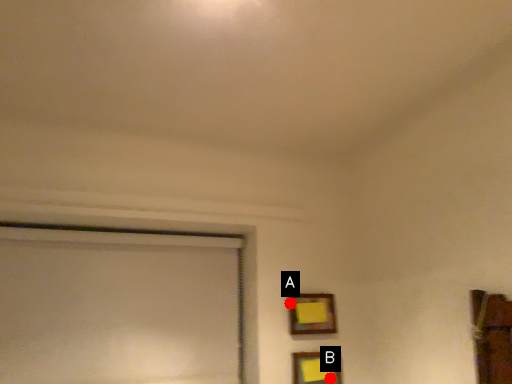
Question: Two points are circled on the image, labeled by A and B beside each circle. Which point appears farthest from the camera in this image?

Choices:
 (A) A is further
 (B) B is further

Answer: (A)